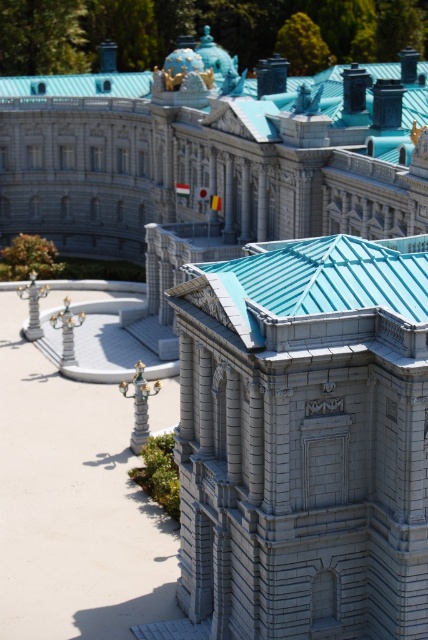
Question: Is gray stone tower at center wider than smooth white palace at center?

Choices:
 (A) no
 (B) yes

Answer: (A)

Question: Can you confirm if gray stone tower at center is bigger than smooth white palace at center?

Choices:
 (A) no
 (B) yes

Answer: (A)

Question: Which of the following is the farthest from the observer?

Choices:
 (A) smooth white palace at center
 (B) gray stone tower at center

Answer: (A)

Question: Where is gray stone tower at center located in relation to smooth white palace at center in the image?

Choices:
 (A) above
 (B) below

Answer: (B)